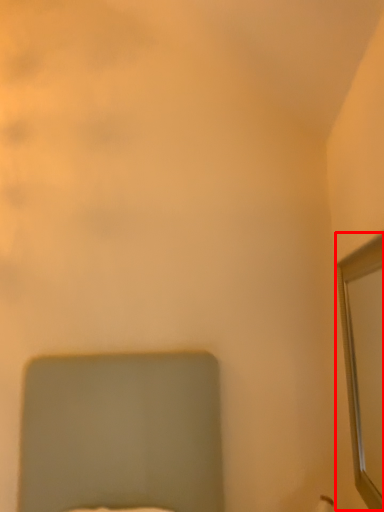
Question: Considering the relative positions of mirror (annotated by the red box) and bed in the image provided, where is mirror (annotated by the red box) located with respect to the staircase?

Choices:
 (A) left
 (B) right

Answer: (B)